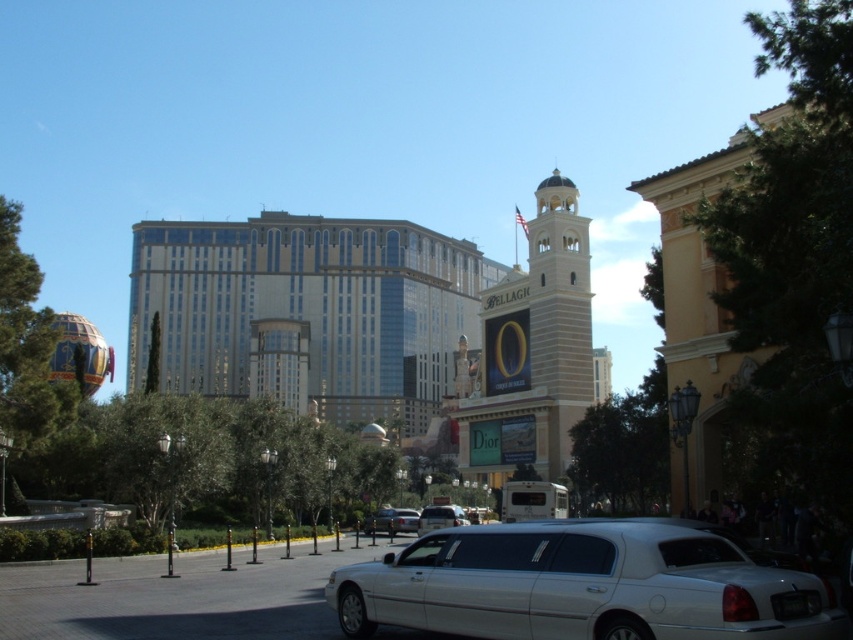
Consider the image. You are standing in front of the modern hotel building with a glass facade. You see a point marked at coordinates (532,349). Based on the scene description, can you identify which architectural feature this point corresponds to?

The point at coordinates (532,349) is located on the beige stone clock tower at center.

You are standing in front of the modern hotel building with the glass facade. You see a point marked at coordinates (582, 586). What object is located at this point?

The point at coordinates (582, 586) marks the location of the white glossy limousine at lower center.